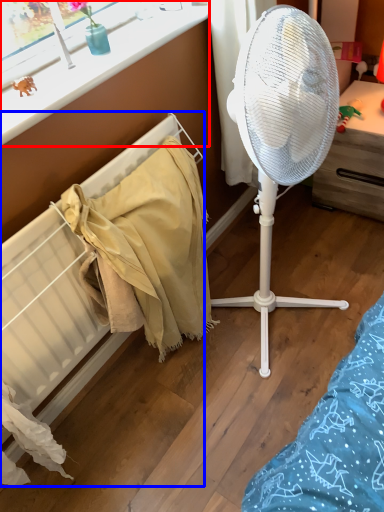
Question: Which object is further to the camera taking this photo, window frame (highlighted by a red box) or radiator (highlighted by a blue box)?

Choices:
 (A) window frame
 (B) radiator

Answer: (A)